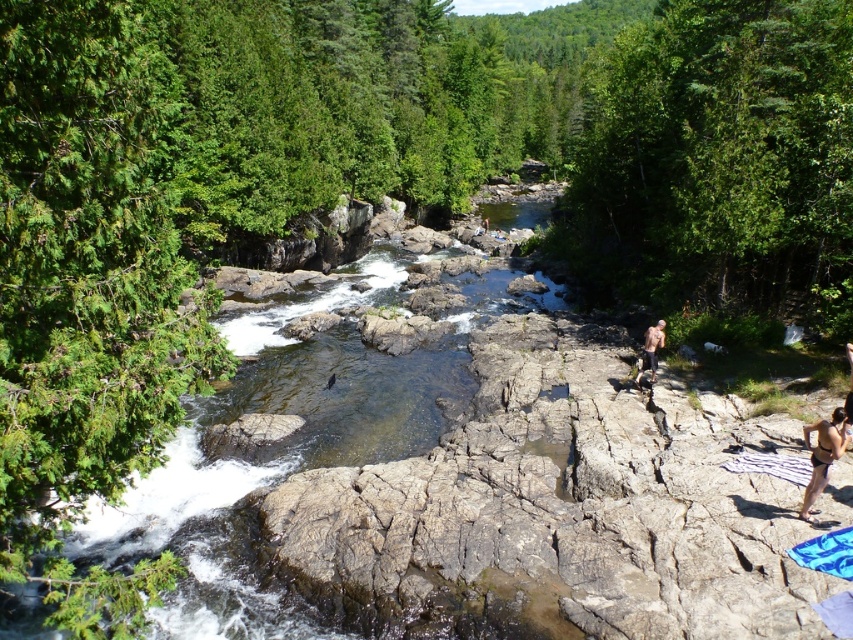
You are a hiker who slipped near the river. You see clear water at center and brown skin at lower right. Which object is above the other?

The clear water at center is positioned over brown skin at lower right, meaning the clear water at center is above the brown skin at lower right.

Consider the image. You are a hiker who wants to cross the river at the clear water at center. Given that the river is 2 meters wide at this point, can you safely cross it if your maximum safe crossing width is 1.8 meters?

The river is 2 meters wide at the clear water at center, which exceeds your maximum safe crossing width of 1.8 meters. Therefore, it is not safe to cross here.